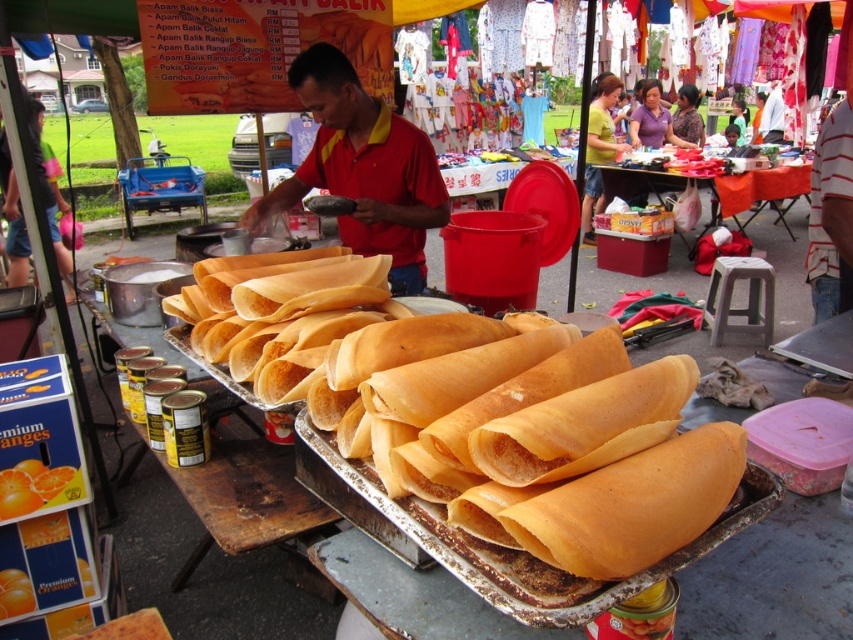
Question: Does red matte shirt at center lie behind orange fabric table at center?

Choices:
 (A) no
 (B) yes

Answer: (A)

Question: Does golden crispy roti at center appear on the left side of red matte shirt at center?

Choices:
 (A) no
 (B) yes

Answer: (A)

Question: Does red matte shirt at center have a lesser width compared to orange fabric table at center?

Choices:
 (A) no
 (B) yes

Answer: (B)

Question: Among these points, which one is farthest from the camera?

Choices:
 (A) (310, 93)
 (B) (602, 573)

Answer: (A)

Question: Which point is closer to the camera?

Choices:
 (A) red matte shirt at center
 (B) golden crispy roti at center

Answer: (B)

Question: Among these objects, which one is farthest from the camera?

Choices:
 (A) orange fabric table at center
 (B) golden crispy roti at center

Answer: (A)